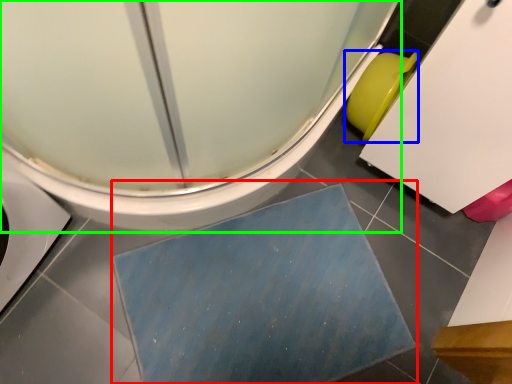
Question: Based on their relative distances, which object is nearer to bath mat (highlighted by a red box)? Choose from toilet bowl (highlighted by a blue box) and toilet (highlighted by a green box).

Choices:
 (A) toilet bowl
 (B) toilet

Answer: (B)